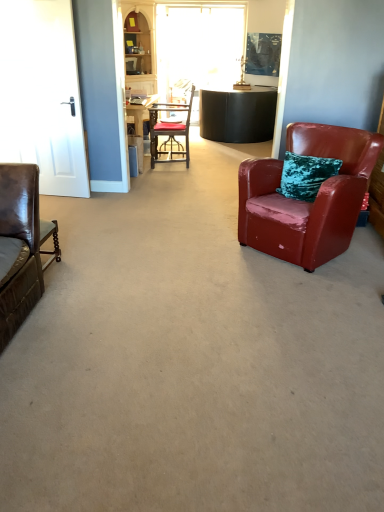
Question: Should I look upward or downward to see shiny red leather armchair at right, marked as the second chair in a top-to-bottom arrangement?

Choices:
 (A) down
 (B) up

Answer: (B)

Question: Considering the relative sizes of matte black chair at center, the first chair in the back-to-front sequence, and shiny red leather armchair at right, placed as the 2th chair when sorted from left to right, in the image provided, is matte black chair at center, the first chair in the back-to-front sequence, shorter than shiny red leather armchair at right, placed as the 2th chair when sorted from left to right,?

Choices:
 (A) yes
 (B) no

Answer: (B)

Question: Is matte black chair at center, positioned as the second chair in front-to-back order, at the left side of shiny red leather armchair at right, placed as the 2th chair when sorted from left to right?

Choices:
 (A) no
 (B) yes

Answer: (B)

Question: From a real-world perspective, is matte black chair at center, arranged as the 2th chair when viewed from the right, located beneath shiny red leather armchair at right, placed as the 2th chair when sorted from left to right?

Choices:
 (A) no
 (B) yes

Answer: (A)

Question: From the image's perspective, is matte black chair at center, the first chair in the back-to-front sequence, below shiny red leather armchair at right, arranged as the second chair when viewed from the back?

Choices:
 (A) yes
 (B) no

Answer: (B)

Question: Does matte black chair at center, which is the first chair in left-to-right order, lie behind shiny red leather armchair at right, which is the first chair in bottom-to-top order?

Choices:
 (A) yes
 (B) no

Answer: (A)

Question: Does matte black chair at center, which is the second chair from bottom to top, have a larger size compared to shiny red leather armchair at right, arranged as the 1th chair when viewed from the right?

Choices:
 (A) no
 (B) yes

Answer: (A)

Question: From a real-world perspective, is white glossy door at left on shiny red leather armchair at right, arranged as the second chair when viewed from the back?

Choices:
 (A) yes
 (B) no

Answer: (A)

Question: From the image's perspective, is white glossy door at left over shiny red leather armchair at right, marked as the second chair in a top-to-bottom arrangement?

Choices:
 (A) yes
 (B) no

Answer: (A)

Question: From a real-world perspective, is white glossy door at left beneath shiny red leather armchair at right, arranged as the 1th chair when viewed from the right?

Choices:
 (A) no
 (B) yes

Answer: (A)

Question: Are white glossy door at left and shiny red leather armchair at right, arranged as the second chair when viewed from the back, beside each other?

Choices:
 (A) no
 (B) yes

Answer: (A)

Question: Is white glossy door at left to the right of shiny red leather armchair at right, placed as the 2th chair when sorted from left to right, from the viewer's perspective?

Choices:
 (A) no
 (B) yes

Answer: (A)

Question: Does white glossy door at left have a greater width compared to shiny red leather armchair at right, which is the first chair in bottom-to-top order?

Choices:
 (A) no
 (B) yes

Answer: (A)

Question: From the image's perspective, is wooden cabinet at upper left under matte black chair at center, the 1th chair viewed from the top?

Choices:
 (A) yes
 (B) no

Answer: (B)